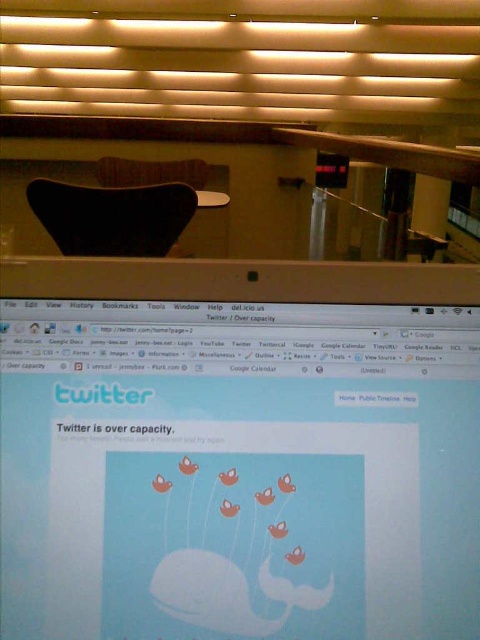
Can you confirm if satin silver laptop at center is positioned below black matte chair at upper center?

Yes, satin silver laptop at center is below black matte chair at upper center.

Who is higher up, satin silver laptop at center or black matte chair at upper center?

black matte chair at upper center is higher up.

Identify the location of satin silver laptop at center. The image size is (480, 640). (239, 451).